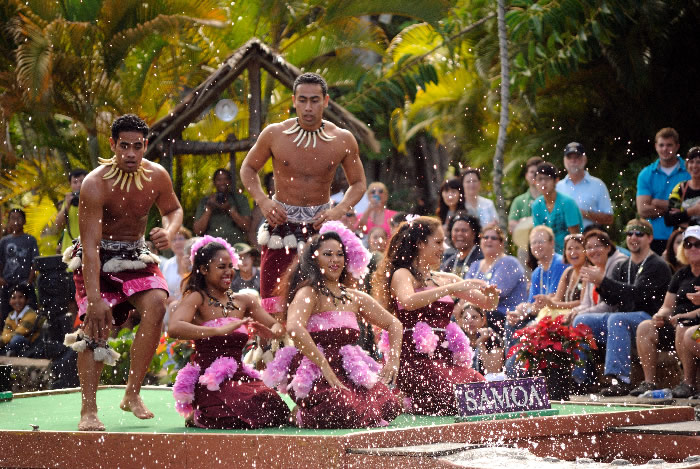
Where is `green part of stage`? This screenshot has width=700, height=469. green part of stage is located at coordinates (161, 411).